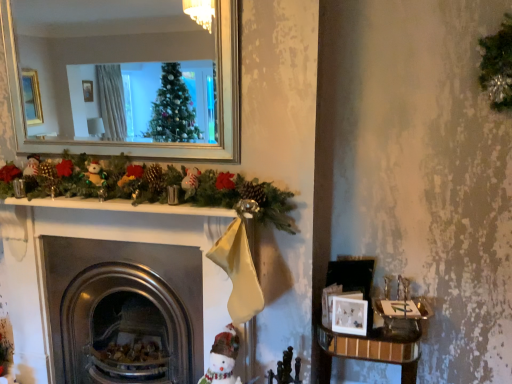
Question: Is wooden table at lower right spatially inside white matte picture frame at lower right, or outside of it?

Choices:
 (A) outside
 (B) inside

Answer: (A)

Question: From a real-world perspective, is wooden table at lower right above or below white matte picture frame at lower right?

Choices:
 (A) below
 (B) above

Answer: (A)

Question: Estimate the real-world distances between objects in this image. Which object is closer to the metallic fireplace at center?

Choices:
 (A) white matte picture frame at lower right
 (B) white fabric snowman at lower center
 (C) wooden table at lower right

Answer: (B)

Question: Based on their relative distances, which object is farther from the metallic fireplace at center?

Choices:
 (A) white fabric snowman at lower center
 (B) wooden table at lower right
 (C) white matte picture frame at lower right

Answer: (B)